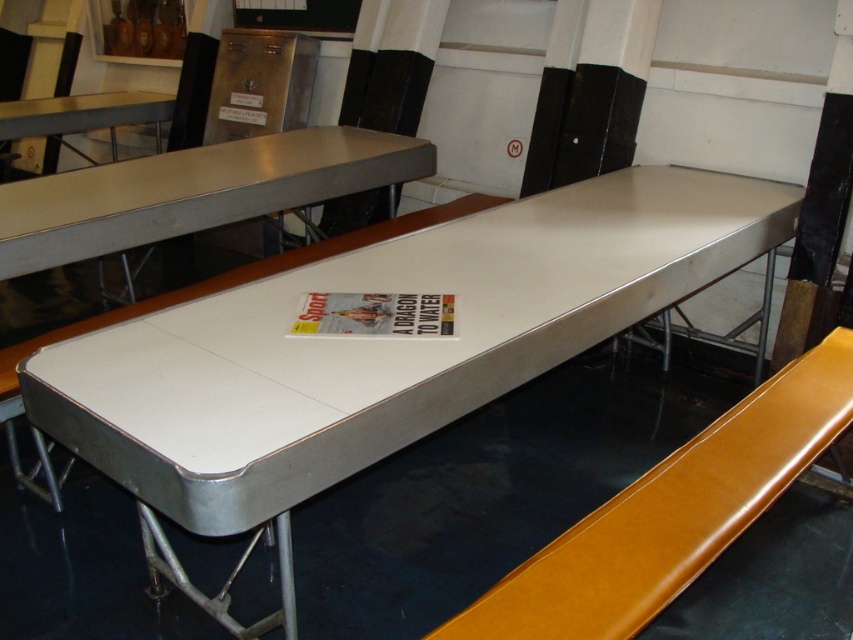
Question: Which of the following is the closest to the observer?

Choices:
 (A) white glossy table at center
 (B) matte yellow bench at center
 (C) metallic silver table at center

Answer: (A)

Question: Where is white glossy table at center located in relation to matte yellow bench at center in the image?

Choices:
 (A) right
 (B) left

Answer: (B)

Question: Estimate the real-world distances between objects in this image. Which object is farther from the matte yellow bench at center?

Choices:
 (A) metallic silver table at center
 (B) white glossy table at center

Answer: (A)

Question: Does matte yellow bench at center come in front of metallic silver table at center?

Choices:
 (A) yes
 (B) no

Answer: (A)

Question: Which object appears closest to the camera in this image?

Choices:
 (A) matte yellow bench at center
 (B) metallic silver table at center

Answer: (A)

Question: Does white glossy table at center have a larger size compared to metallic silver table at center?

Choices:
 (A) yes
 (B) no

Answer: (A)